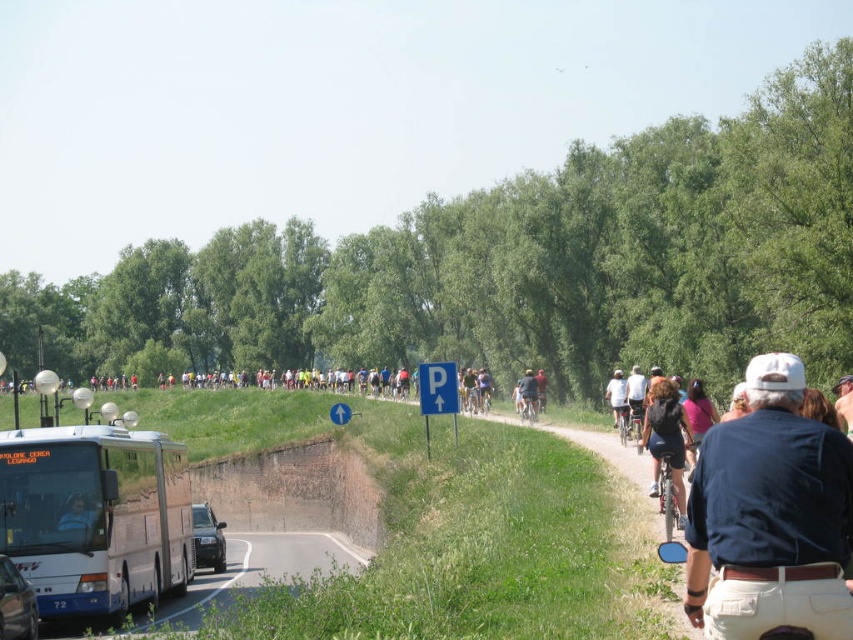
Question: Which point is farther to the camera?

Choices:
 (A) dark blue shirt at lower right
 (B) dark blue shirt at center
 (C) shiny metallic bicycle at right

Answer: (B)

Question: Which of the following is the farthest from the observer?

Choices:
 (A) dark blue shirt at lower right
 (B) shiny metallic bicycle at right

Answer: (B)

Question: Observing the image, what is the correct spatial positioning of white matte bus at lower left in reference to dark blue fabric backpack at right?

Choices:
 (A) above
 (B) below

Answer: (B)

Question: Can you confirm if matte black jacket at center is positioned to the left of dark blue shirt at center?

Choices:
 (A) no
 (B) yes

Answer: (B)

Question: Which point is closer to the camera?

Choices:
 (A) dark blue fabric backpack at right
 (B) white matte bus at lower left

Answer: (A)

Question: Is dark blue fabric backpack at right positioned in front of dark blue shirt at center?

Choices:
 (A) yes
 (B) no

Answer: (A)